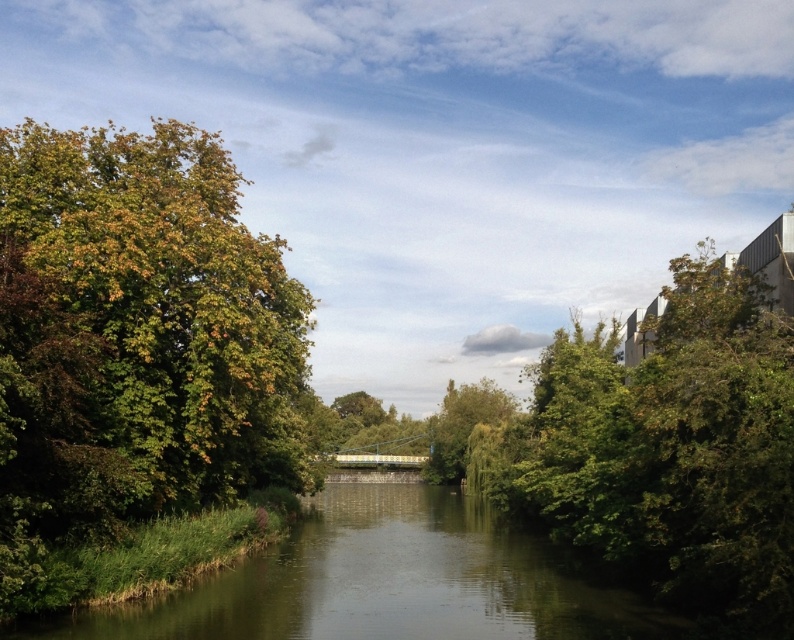
You are standing at the riverside and want to take a photo that includes both the green smooth water at center and the green leafy tree at center. If your camera can focus on objects up to 30 meters away, will both subjects be in focus?

The green smooth water at center is 36.04 meters away from green leafy tree at center. Since the camera can only focus up to 30 meters, the subjects are too far apart to both be in focus.

You are standing at the riverside and want to take a photo that includes both the green smooth water at center and the green leafy tree at center. Which object should you position closer to the front of your photo to ensure both are in focus?

To ensure both the green smooth water at center and the green leafy tree at center are in focus, position the green smooth water at center closer to the front since it is nearer to the viewer than the green leafy tree at center.

You are planning to plant a new tree in your backyard. You have two options based on the image you see. The first option is the green leafy tree at left, and the second is the green leafy tree at right. If you want a taller tree for privacy, which one should you choose?

Result: The green leafy tree at left is much taller than the green leafy tree at right, so you should choose the green leafy tree at left for better privacy.